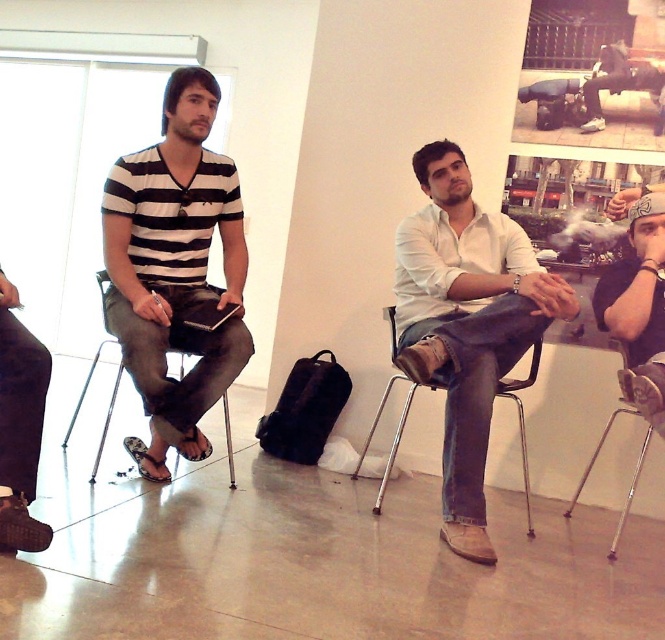
You are standing in the room and want to hand a document to the person wearing the black matte shirt at upper right. Since you can only reach up to shoulder height, can you place the document directly on the metallic silver chair at center without needing a ladder?

The black matte shirt at upper right is above the metallic silver chair at center, meaning the shirt is higher than the chair. Since you can only reach up to shoulder height, you can place the document directly on the metallic silver chair at center without needing a ladder because the chair is lower than your reach.

You are standing in the room and want to hand a document to the person wearing the black matte shirt at upper right. Since you can only move around the metallic silver chair at center, can you reach them by going around the left side of the chair?

The black matte shirt at upper right is positioned on the right side of metallic silver chair at center, so going around the left side of the chair would not allow you to reach them. You need to go around the right side of the chair instead.

You are a service robot in the room. You need to move a small package from the dark brown leather shoes at lower left to the metallic silver chair at lower right. What is the minimum distance you need to travel to complete this task?

The minimum distance you need to travel is 1.91 meters, as the dark brown leather shoes at lower left is 1.91 meters away from the metallic silver chair at lower right.